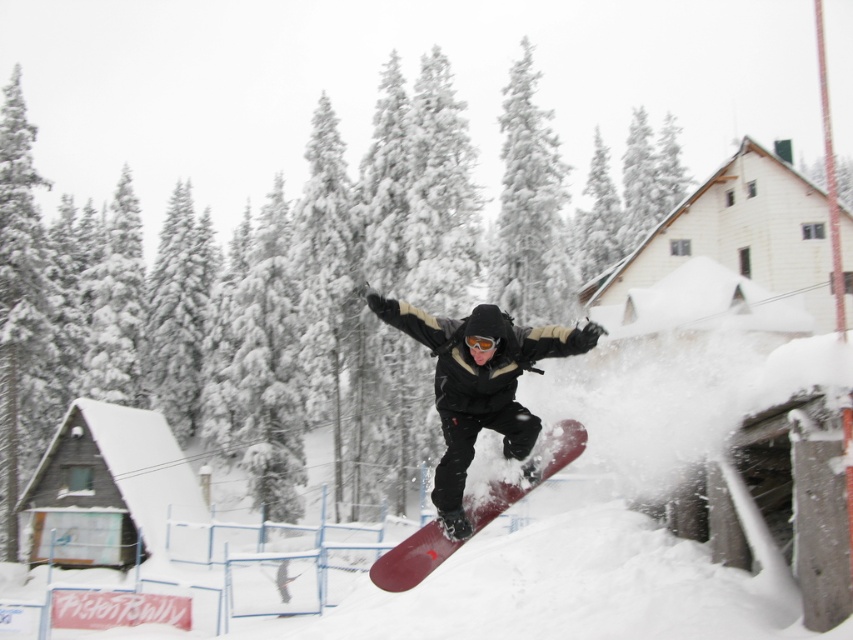
Does matte black snowboard at center appear under matte red snowboard at center?

No, matte black snowboard at center is not below matte red snowboard at center.

Is matte black snowboard at center further to the viewer compared to matte red snowboard at center?

No, it is in front of matte red snowboard at center.

The image size is (853, 640). What do you see at coordinates (479, 385) in the screenshot?
I see `matte black snowboard at center` at bounding box center [479, 385].

This screenshot has width=853, height=640. I want to click on matte black snowboard at center, so 479,385.